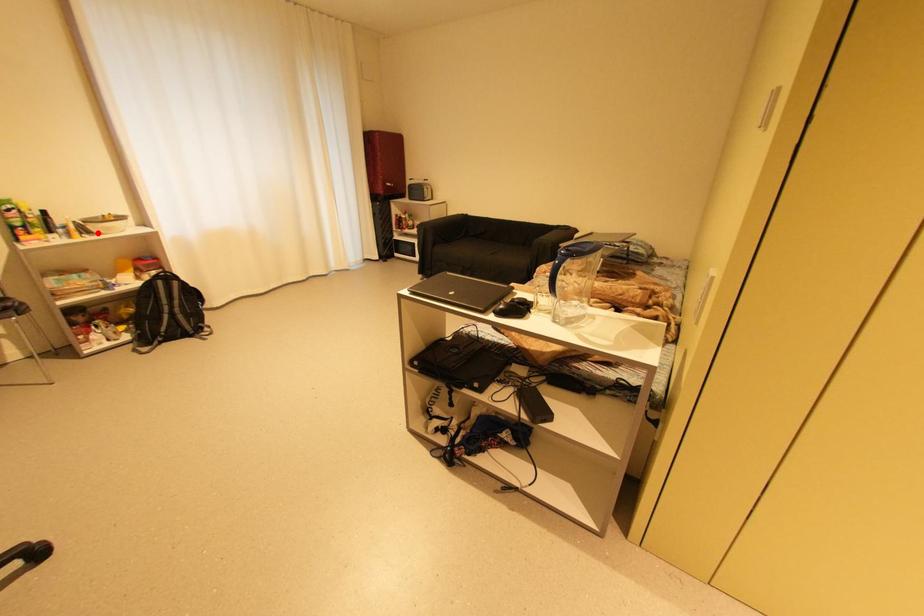
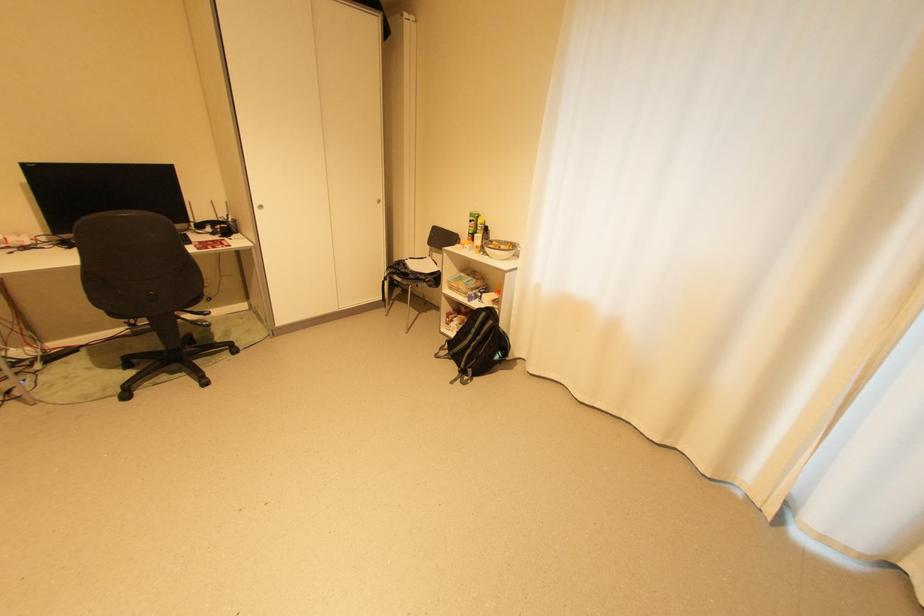
Question: I am providing you with two images of the same scene from different viewpoints. Given a red point in image1, look at the same physical point in image2. Is it:

Choices:
 (A) Closer to the viewpoint
 (B) Farther from the viewpoint

Answer: (A)